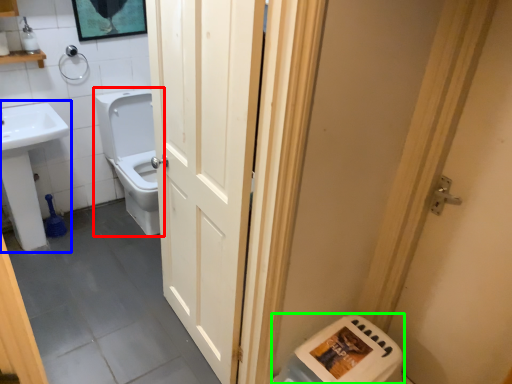
Question: Estimate the real-world distances between objects in this image. Which object is closer to toilet (highlighted by a red box), sink (highlighted by a blue box) or water heater (highlighted by a green box)?

Choices:
 (A) sink
 (B) water heater

Answer: (A)